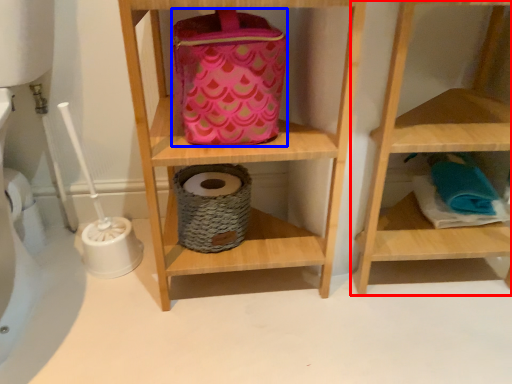
Question: Which object is closer to the camera taking this photo, shelf (highlighted by a red box) or pouch (highlighted by a blue box)?

Choices:
 (A) shelf
 (B) pouch

Answer: (A)